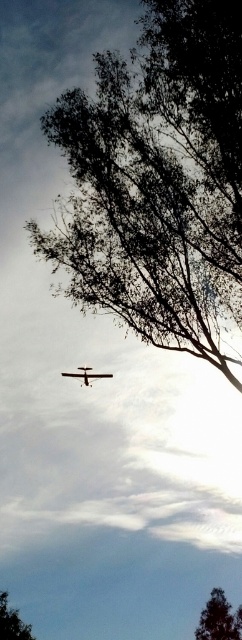
Question: Observing the image, what is the correct spatial positioning of green leafy tree at upper center in reference to green leafy tree at lower left?

Choices:
 (A) right
 (B) left

Answer: (A)

Question: Which of the following is the closest to the observer?

Choices:
 (A) green leafy tree at upper center
 (B) green leafy tree at lower left
 (C) green leafy tree at lower right

Answer: (A)

Question: Which point appears closest to the camera in this image?

Choices:
 (A) (217, 621)
 (B) (239, 65)
 (C) (16, 627)

Answer: (B)

Question: Is the position of green leafy tree at upper center less distant than that of green leafy tree at lower left?

Choices:
 (A) no
 (B) yes

Answer: (B)

Question: Does green leafy tree at upper center have a greater width compared to green leafy tree at lower left?

Choices:
 (A) no
 (B) yes

Answer: (B)

Question: Which point is closer to the camera taking this photo?

Choices:
 (A) (84, 381)
 (B) (150, 125)

Answer: (B)